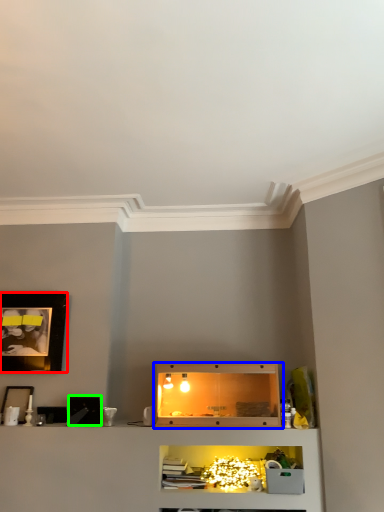
Question: Which object is positioned closest to picture frame (highlighted by a red box)? Select from shelf (highlighted by a blue box) and picture frame (highlighted by a green box).

Choices:
 (A) shelf
 (B) picture frame

Answer: (B)